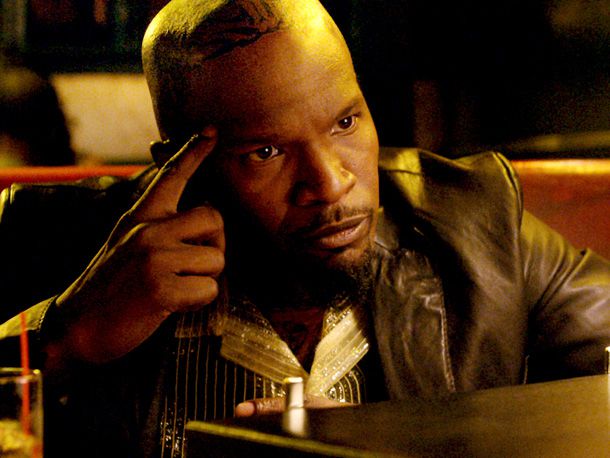
Find the location of a particular element. The image size is (610, 458). black tabletop is located at coordinates (584, 392), (381, 431), (571, 443).